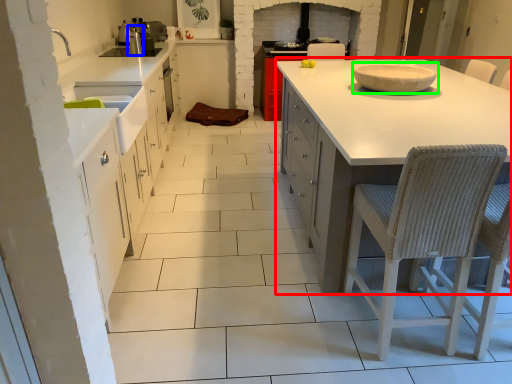
Question: Which object is the closest to the countertop (highlighted by a red box)? Choose among these: appliance (highlighted by a blue box) or bowl (highlighted by a green box).

Choices:
 (A) appliance
 (B) bowl

Answer: (B)